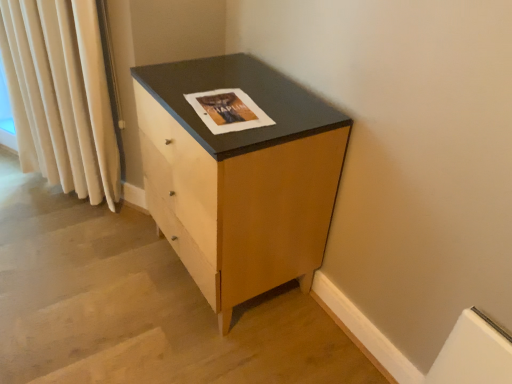
Question: Considering the positions of point (82, 26) and point (193, 91), is point (82, 26) closer or farther from the camera than point (193, 91)?

Choices:
 (A) farther
 (B) closer

Answer: (A)

Question: Considering their positions, is cream velvet curtain at left located in front of or behind matte wood chest of drawers at center?

Choices:
 (A) behind
 (B) front

Answer: (A)

Question: Which is nearer to the matte paper magazine at center?

Choices:
 (A) matte wood chest of drawers at center
 (B) cream velvet curtain at left

Answer: (A)

Question: Which is farther from the matte paper magazine at center?

Choices:
 (A) matte wood chest of drawers at center
 (B) cream velvet curtain at left

Answer: (B)